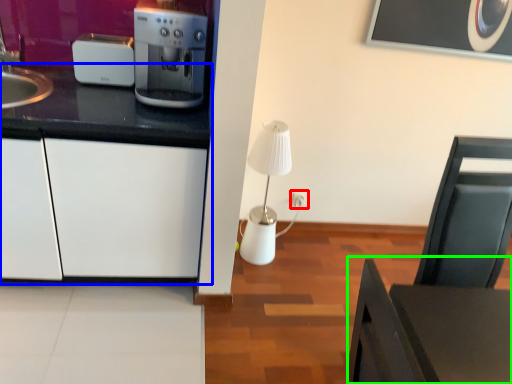
Question: Estimate the real-world distances between objects in this image. Which object is closer to electric outlet (highlighted by a red box), cabinetry (highlighted by a blue box) or table (highlighted by a green box)?

Choices:
 (A) cabinetry
 (B) table

Answer: (A)